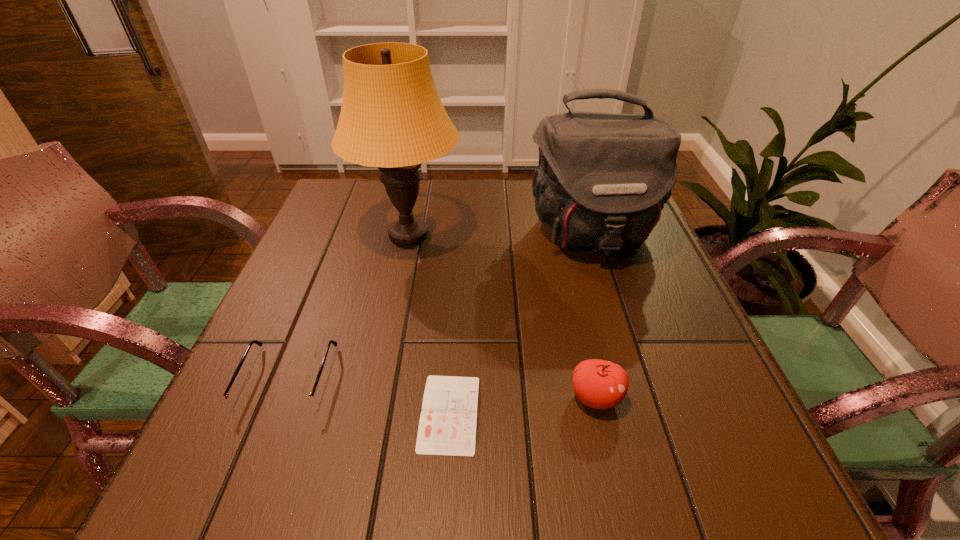
What are the coordinates of `lampshade located at the far edge` in the screenshot? It's located at (391, 117).

Find the location of a particular element. shoulder bag situated at the far edge is located at coordinates coord(602,180).

Identify the location of object positioned at the near edge. The width and height of the screenshot is (960, 540). (447, 426).

Image resolution: width=960 pixels, height=540 pixels. Find the location of `lampshade that is positioned at the left edge`. lampshade that is positioned at the left edge is located at coordinates (391, 117).

At what (x,y) coordinates should I click in order to perform the action: click on spectacles that is at the left edge. Please return your answer as a coordinate pair (x, y). Looking at the image, I should click on (242, 402).

Where is `object that is positioned at the right edge`? The width and height of the screenshot is (960, 540). object that is positioned at the right edge is located at coordinates (602, 180).

Image resolution: width=960 pixels, height=540 pixels. In order to click on object at the far left corner in this screenshot , I will do `click(391, 117)`.

Find the location of a particular element. The width and height of the screenshot is (960, 540). object that is positioned at the far right corner is located at coordinates (602, 180).

The width and height of the screenshot is (960, 540). In the image, there is a desktop. What are the coordinates of `free space at the far edge` in the screenshot? It's located at (532, 190).

At what (x,y) coordinates should I click in order to perform the action: click on vacant space at the near edge. Please return your answer as a coordinate pair (x, y). The width and height of the screenshot is (960, 540). Looking at the image, I should click on (579, 490).